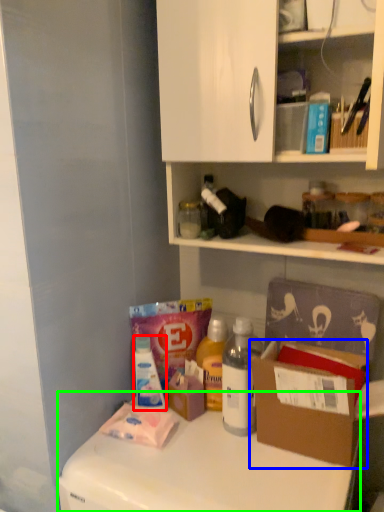
Question: Which object is positioned farthest from bottle (highlighted by a red box)? Select from cardboard box (highlighted by a blue box) and counter top (highlighted by a green box).

Choices:
 (A) cardboard box
 (B) counter top

Answer: (A)